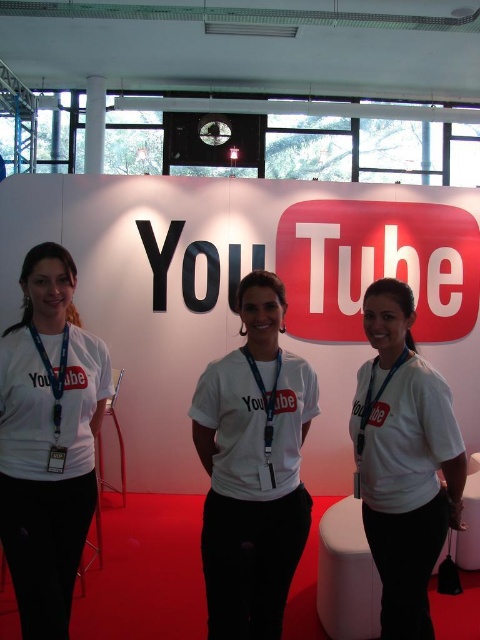
Is white cotton shirt at center shorter than metallic vip card at lower left?

No, white cotton shirt at center is not shorter than metallic vip card at lower left.

Can you confirm if white cotton shirt at center is thinner than metallic vip card at lower left?

No, white cotton shirt at center is not thinner than metallic vip card at lower left.

Does point (377, 468) come in front of point (49, 458)?

No, it is behind (49, 458).

Where is `white cotton shirt at center`? The image size is (480, 640). white cotton shirt at center is located at coordinates (404, 460).

Who is more distant from viewer, (249, 280) or (344, 600)?

The point (344, 600) is behind.

Measure the distance between point (252, 451) and camera.

Point (252, 451) and camera are 5.86 feet apart from each other.

You are a GUI agent. You are given a task and a screenshot of the screen. Output one action in this format:
    pyautogui.click(x=<x>, y=<y>)
    Task: Click on the white cotton t-shirt at center
    The height and width of the screenshot is (640, 480).
    Given the screenshot: What is the action you would take?
    (252, 468)

Who is more forward, (261, 360) or (54, 451)?

Point (54, 451)

Does point (210, 424) come farther from viewer compared to point (57, 445)?

Yes.

This screenshot has width=480, height=640. What are the coordinates of `white cotton t-shirt at center` in the screenshot? It's located at (252, 468).